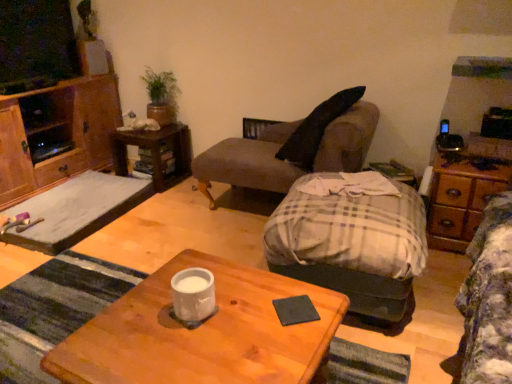
Where is `vacant space situated on the left part of gray fabric couch at center, placed as the 1th studio couch when sorted from back to front`? vacant space situated on the left part of gray fabric couch at center, placed as the 1th studio couch when sorted from back to front is located at coordinates (173, 225).